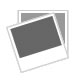
Find the location of a particular element. This screenshot has width=80, height=80. polaroid pictures is located at coordinates (41, 32), (62, 18).